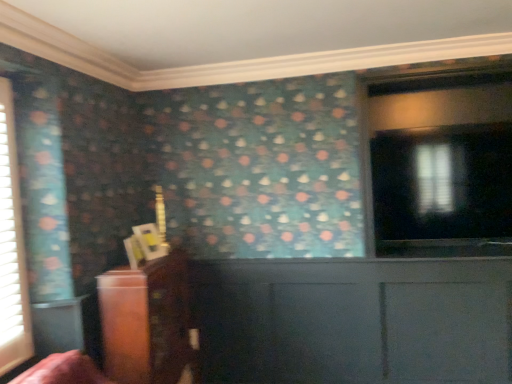
Question: Considering the positions of point (10, 142) and point (169, 365), is point (10, 142) closer or farther from the camera than point (169, 365)?

Choices:
 (A) closer
 (B) farther

Answer: (A)

Question: Is white textured blinds at left taller or shorter than wooden cabinet at left?

Choices:
 (A) short
 (B) tall

Answer: (B)

Question: Based on their relative distances, which object is nearer to the white textured blinds at left?

Choices:
 (A) transparent glass window at upper right
 (B) wooden cabinet at left

Answer: (B)

Question: Estimate the real-world distances between objects in this image. Which object is farther from the white textured blinds at left?

Choices:
 (A) transparent glass window at upper right
 (B) wooden cabinet at left

Answer: (A)